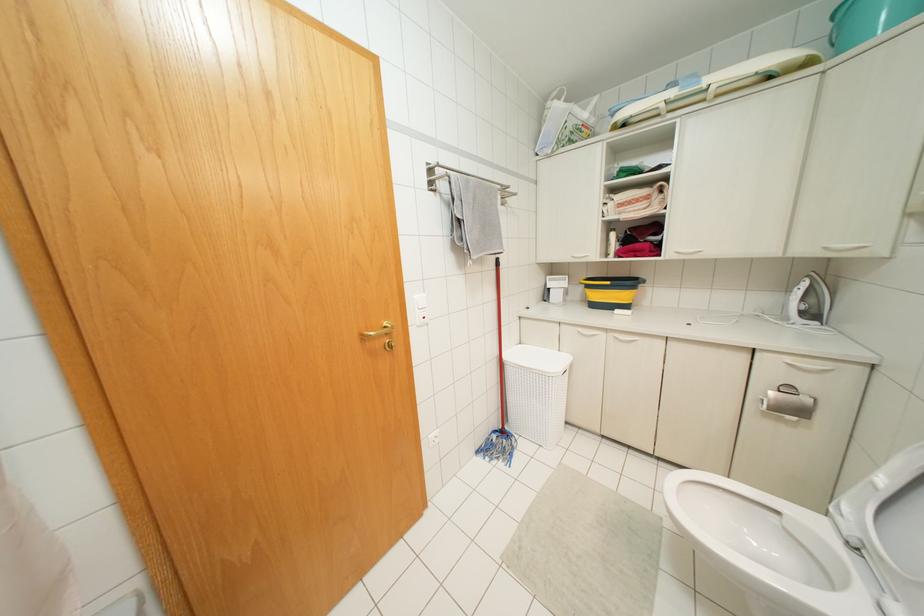
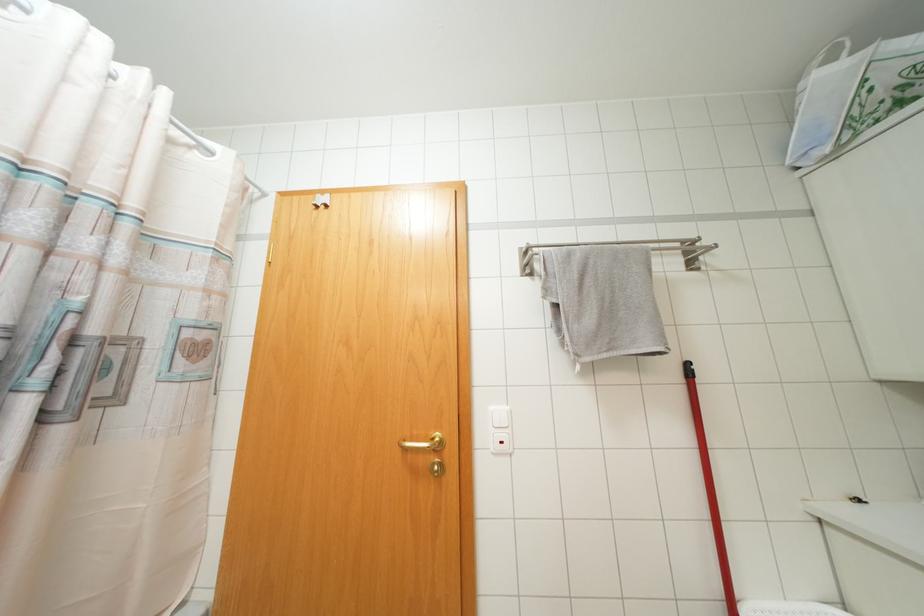
The images are taken continuously from a first-person perspective. In which direction is your viewpoint rotating?

The camera's rotation is toward left-up.